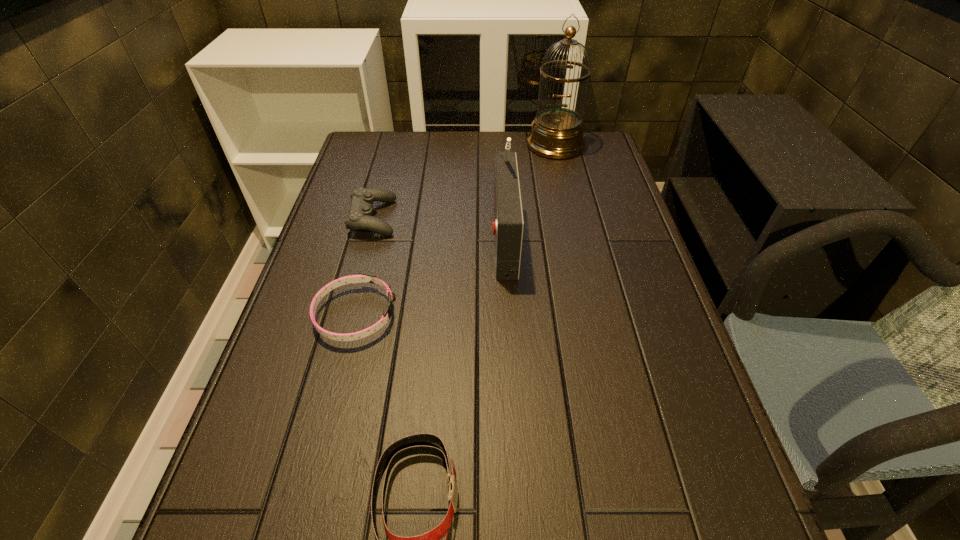
Locate an element on the screen. The width and height of the screenshot is (960, 540). free spot located on the front panel of the second tallest object is located at coordinates (453, 236).

I want to click on free space located on the right of the control, so click(427, 218).

Identify the location of free space located with the buckle on the left dog collar. (457, 315).

The image size is (960, 540). I want to click on object located at the far edge, so click(x=557, y=133).

Image resolution: width=960 pixels, height=540 pixels. Identify the location of control that is at the left edge. (360, 217).

The height and width of the screenshot is (540, 960). Identify the location of dog collar at the left edge. (363, 277).

Find the location of a particular element. object at the right edge is located at coordinates (557, 133).

Where is `object that is positioned at the far right corner`? The image size is (960, 540). object that is positioned at the far right corner is located at coordinates coord(557,133).

You are a GUI agent. You are given a task and a screenshot of the screen. Output one action in this format:
    pyautogui.click(x=<x>, y=<y>)
    Task: Click on the vacant region at the far edge
    
    Given the screenshot: What is the action you would take?
    pyautogui.click(x=467, y=154)

In the image, there is a desktop. At what (x,y) coordinates should I click in order to perform the action: click on free space at the left edge. Please return your answer as a coordinate pair (x, y). Looking at the image, I should click on (342, 237).